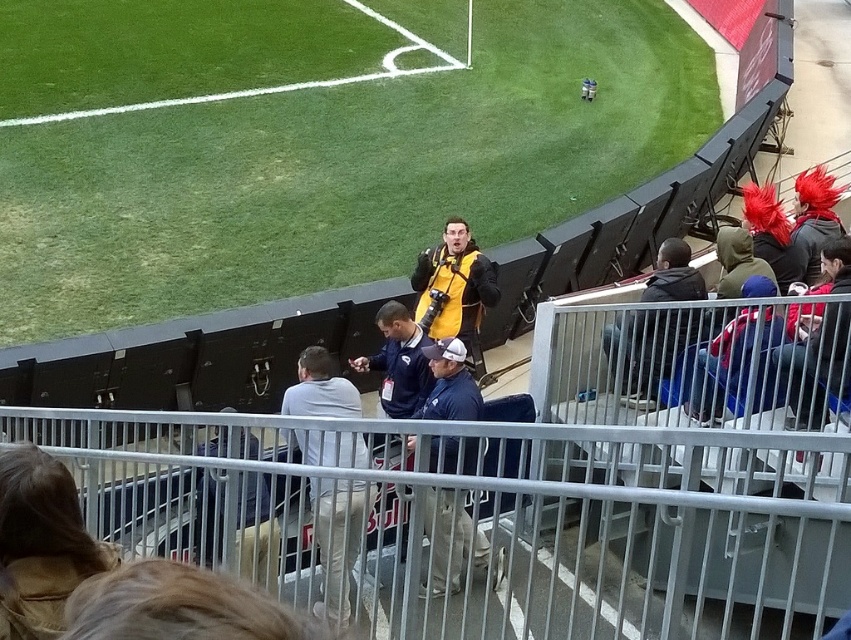
Is white matte pants at center taller than yellow matte vest at center?

In fact, white matte pants at center may be shorter than yellow matte vest at center.

Is point (292, 435) closer to viewer compared to point (418, 275)?

Yes, point (292, 435) is closer to viewer.

Where is `white matte pants at center`? white matte pants at center is located at coordinates (338, 538).

Is green grass at center below yellow matte vest at center?

Actually, green grass at center is above yellow matte vest at center.

Is point (584, 112) behind point (427, 328)?

Yes, point (584, 112) is behind point (427, 328).

Does point (0, 316) come closer to viewer compared to point (470, 349)?

That is False.

Locate an element on the screen. The width and height of the screenshot is (851, 640). green grass at center is located at coordinates (343, 170).

Which is below, metal at center or white matte pants at center?

metal at center

Does point (237, 532) lie in front of point (357, 412)?

That is True.

Locate an element on the screen. This screenshot has height=640, width=851. metal at center is located at coordinates (487, 516).